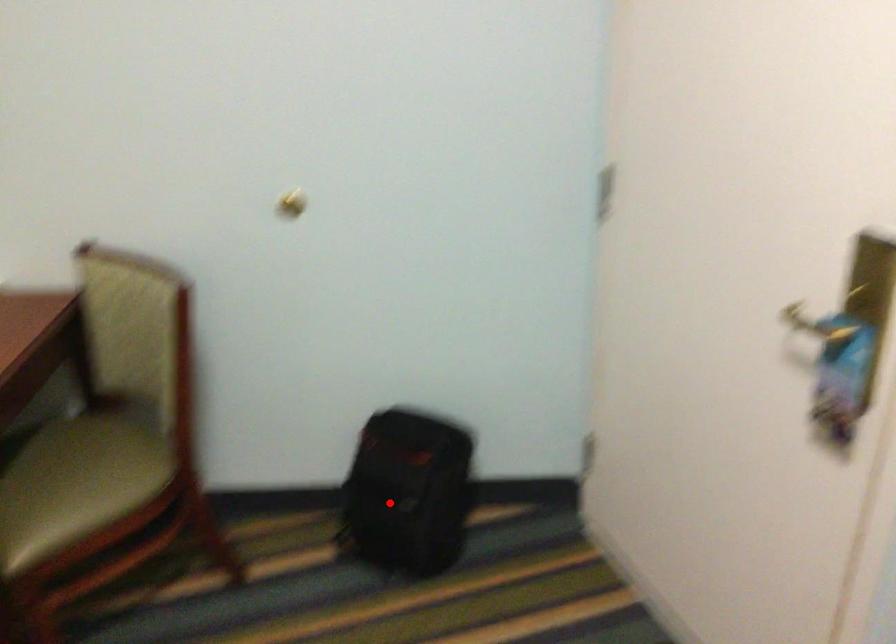
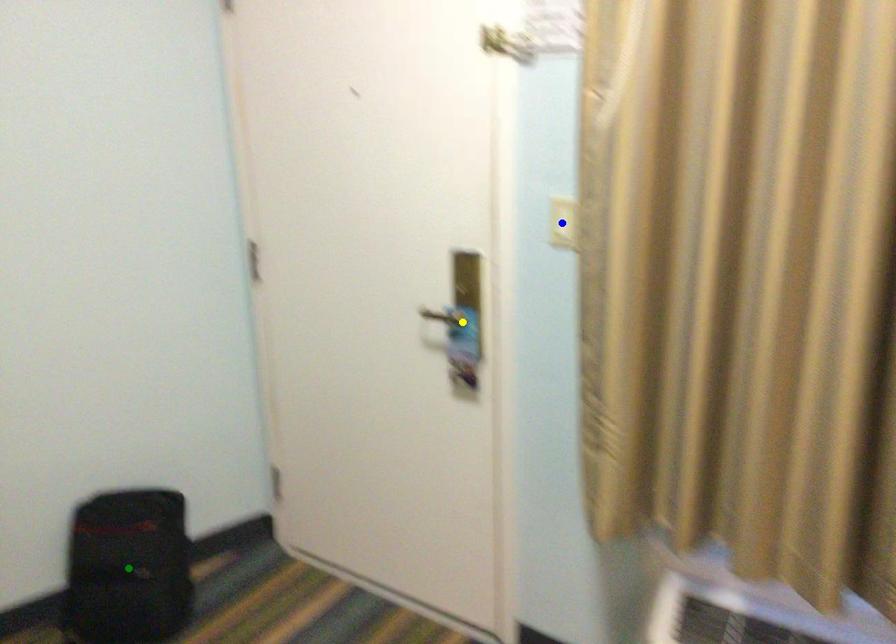
Question: I am providing you with two images of the same scene from different viewpoints. A red point is marked on the first image. You are given multiple points on the second image. In image 2, which mark is for the same physical point as the one in image 1?

Choices:
 (A) yellow point
 (B) green point
 (C) blue point

Answer: (B)